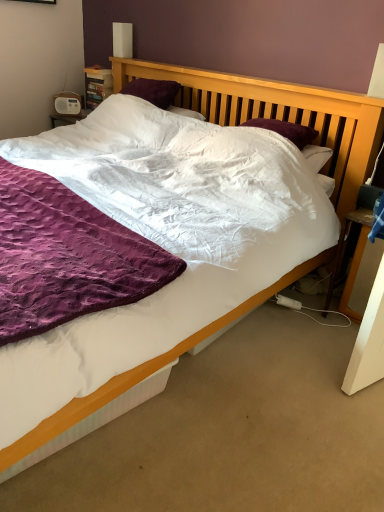
Measure the distance between point (365,228) and camera.

Point (365,228) and camera are 6.61 feet apart from each other.

What do you see at coordinates (359, 266) in the screenshot? I see `wooden nightstand at lower right` at bounding box center [359, 266].

Find the location of a particular element. The image size is (384, 512). wooden nightstand at lower right is located at coordinates (359, 266).

Locate an element on the screen. Image resolution: width=384 pixels, height=512 pixels. wooden nightstand at lower right is located at coordinates pos(359,266).